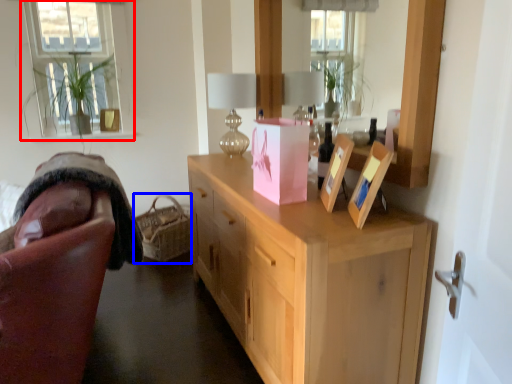
Question: Among these objects, which one is nearest to the camera, window (highlighted by a red box) or basket (highlighted by a blue box)?

Choices:
 (A) window
 (B) basket

Answer: (B)